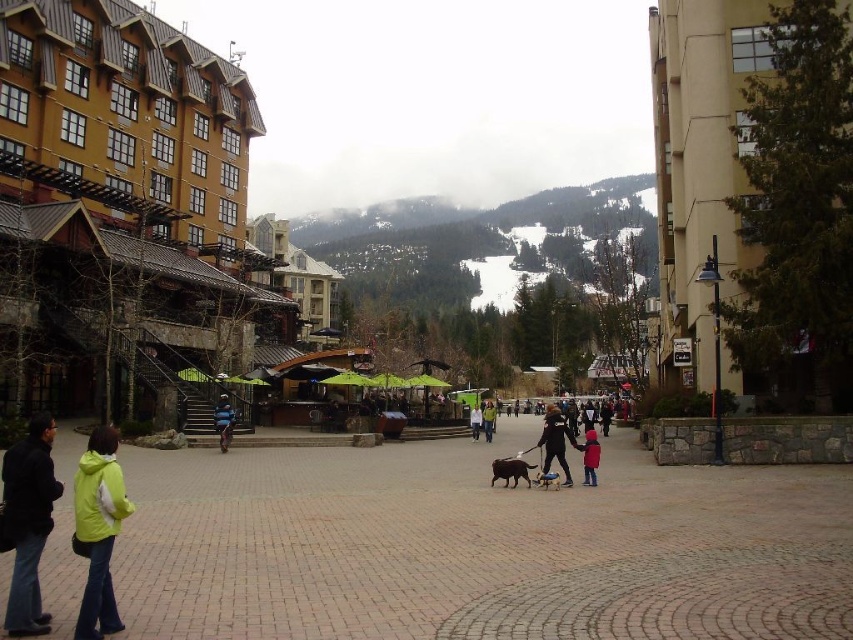
Is point (585, 477) more distant than point (489, 413)?

No, it is not.

Between point (585, 468) and point (491, 429), which one is positioned behind?

The point (491, 429) is behind.

Between point (596, 440) and point (492, 429), which one is positioned behind?

The point (492, 429) is more distant.

The image size is (853, 640). Identify the location of red matte jacket at center. (589, 456).

How much distance is there between black matte jacket at center and red matte jacket at center?

black matte jacket at center is 2.96 meters from red matte jacket at center.

Is the position of black matte jacket at center more distant than that of red matte jacket at center?

No, black matte jacket at center is in front of red matte jacket at center.

Which is behind, point (564, 433) or point (590, 483)?

Positioned behind is point (564, 433).

This screenshot has width=853, height=640. What are the coordinates of `black matte jacket at center` in the screenshot? It's located at (555, 442).

The height and width of the screenshot is (640, 853). What do you see at coordinates (479, 547) in the screenshot? I see `brick pavement at center` at bounding box center [479, 547].

Does brick pavement at center lie behind matte black jacket at lower left?

That is True.

I want to click on brick pavement at center, so click(x=479, y=547).